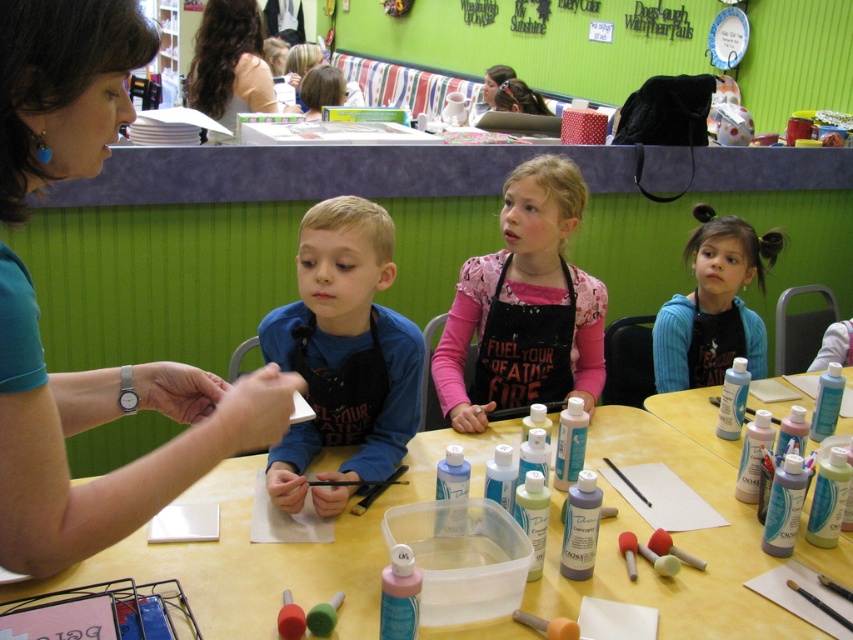
In the scene shown: Between yellow matte table at center and pink matte apron at center, which one is positioned lower?

yellow matte table at center

Between yellow matte table at center and pink matte apron at center, which one is positioned higher?

pink matte apron at center is above.

This screenshot has height=640, width=853. In order to click on yellow matte table at center in this screenshot , I will do `click(274, 550)`.

Between matte teal shirt at upper left and brown hair at upper left, which one is positioned higher?

brown hair at upper left is above.

Is matte teal shirt at upper left behind brown hair at upper left?

No, matte teal shirt at upper left is in front of brown hair at upper left.

Locate an element on the screen. This screenshot has width=853, height=640. matte teal shirt at upper left is located at coordinates (102, 422).

Based on the photo, can you confirm if matte teal shirt at upper left is smaller than translucent plastic bottles at center?

Actually, matte teal shirt at upper left might be larger than translucent plastic bottles at center.

Looking at this image, is matte teal shirt at upper left closer to the viewer compared to translucent plastic bottles at center?

Yes, it is.

Does point (117, 88) lie in front of point (648, 400)?

That is True.

Find the location of a particular element. matte teal shirt at upper left is located at coordinates (102, 422).